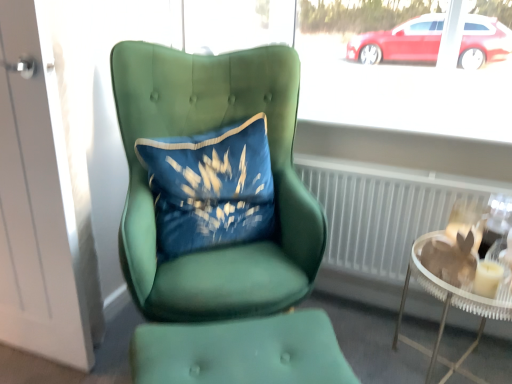
Find the location of a particular element. The width and height of the screenshot is (512, 384). free point above white textured radiator at center (from a real-world perspective) is located at coordinates (426, 157).